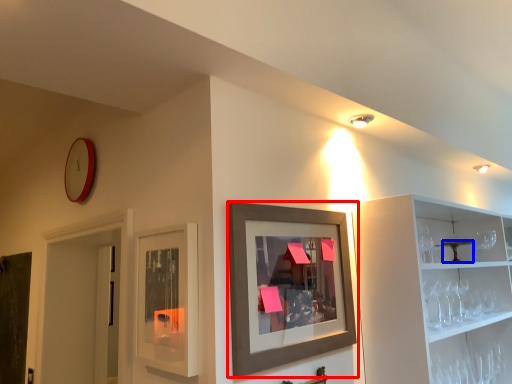
Question: Which of the following is the farthest to the observer, picture frame (highlighted by a red box) or table (highlighted by a blue box)?

Choices:
 (A) picture frame
 (B) table

Answer: (B)